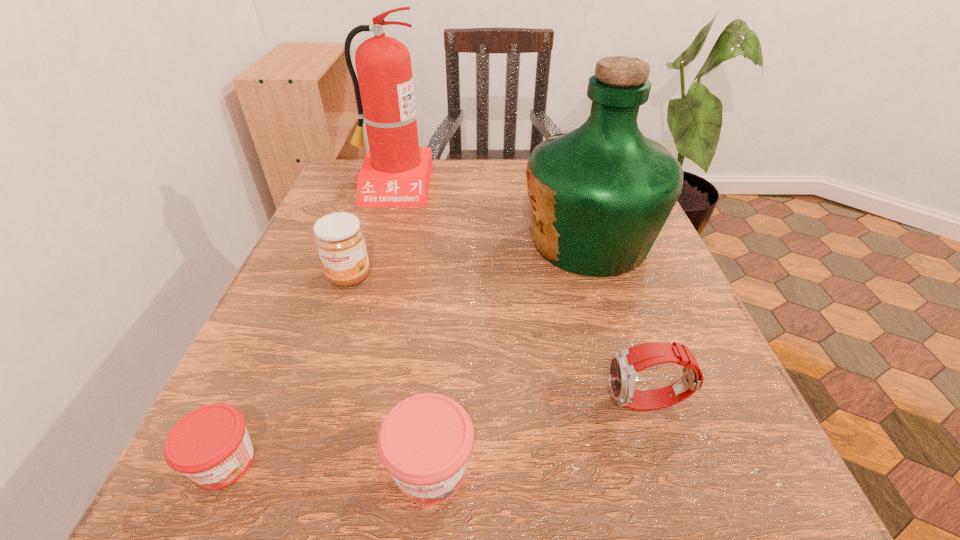
The width and height of the screenshot is (960, 540). I want to click on free spot that satisfies the following two spatial constraints: 1. on the label side of the liquor; 2. on the label side of the shortest object, so click(659, 463).

Locate an element on the screen. vacant space that satisfies the following two spatial constraints: 1. on the face of the third nearest object; 2. on the label side of the shortest jam is located at coordinates (667, 463).

This screenshot has height=540, width=960. I want to click on free space in the image that satisfies the following two spatial constraints: 1. on the label side of the liquor; 2. on the front label of the tallest jam, so click(x=600, y=276).

Locate an element on the screen. This screenshot has height=540, width=960. vacant region that satisfies the following two spatial constraints: 1. on the face of the fourth farthest object; 2. on the front label of the second shortest object is located at coordinates (669, 469).

In order to click on free space that satisfies the following two spatial constraints: 1. on the face of the watch; 2. on the label side of the shortest jam in this screenshot , I will do `click(667, 463)`.